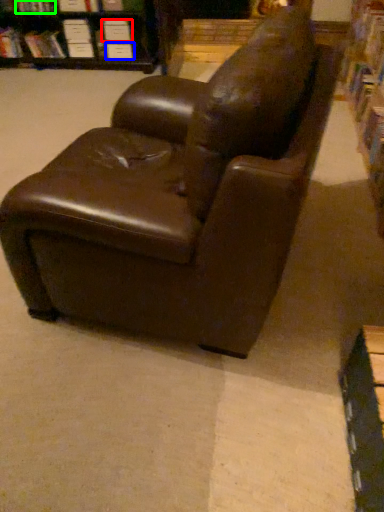
Question: Considering the real-world distances, which object is farthest from paperback book (highlighted by a red box)? paperback book (highlighted by a blue box) or book (highlighted by a green box)?

Choices:
 (A) paperback book
 (B) book

Answer: (B)